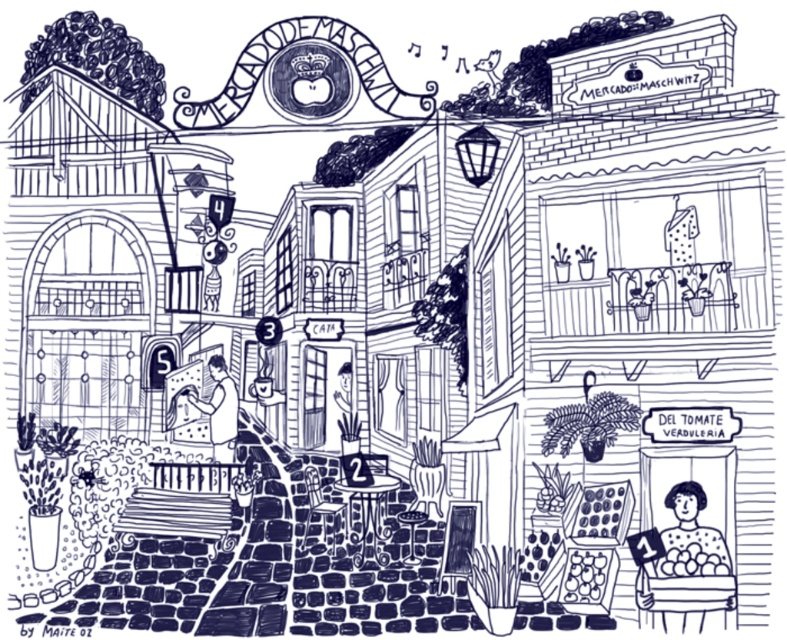
You are standing at the entrance of the building with the large arched doorway on the left side of the street. Looking towards the polka dot dress at lower right marked by point (686,566), is there a direct line of sight to it without any obstructions?

Yes, the polka dot dress at lower right marked by point (686,566) is visible from the entrance of the building with the large arched doorway on the left side of the street as there are no obstructions blocking the line of sight between them.

You are a customer in this market and you want to buy both the polka dot dress at lower right and the smooth black shirt at center. Which item is positioned lower in the image?

The polka dot dress at lower right is located below the smooth black shirt at center, so it is positioned lower in the image.